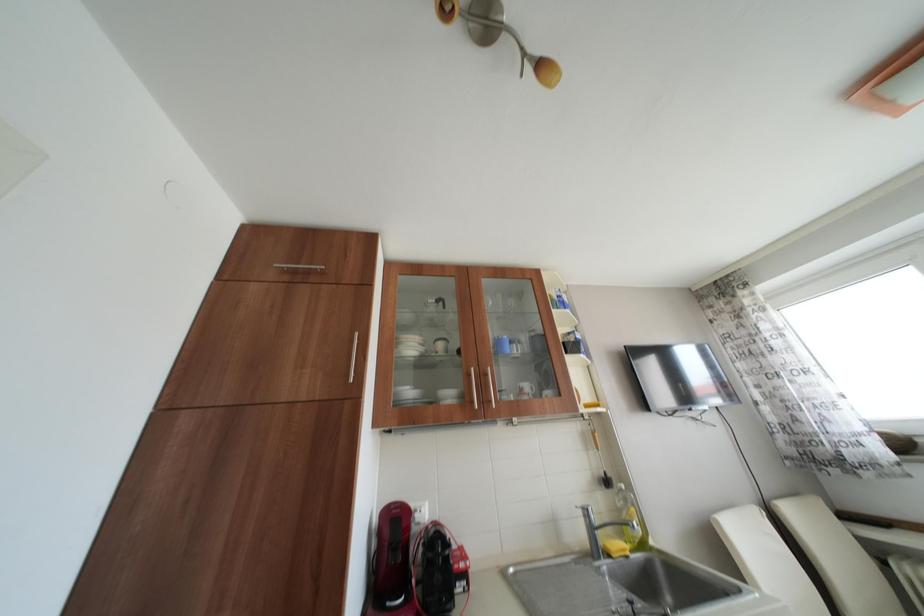
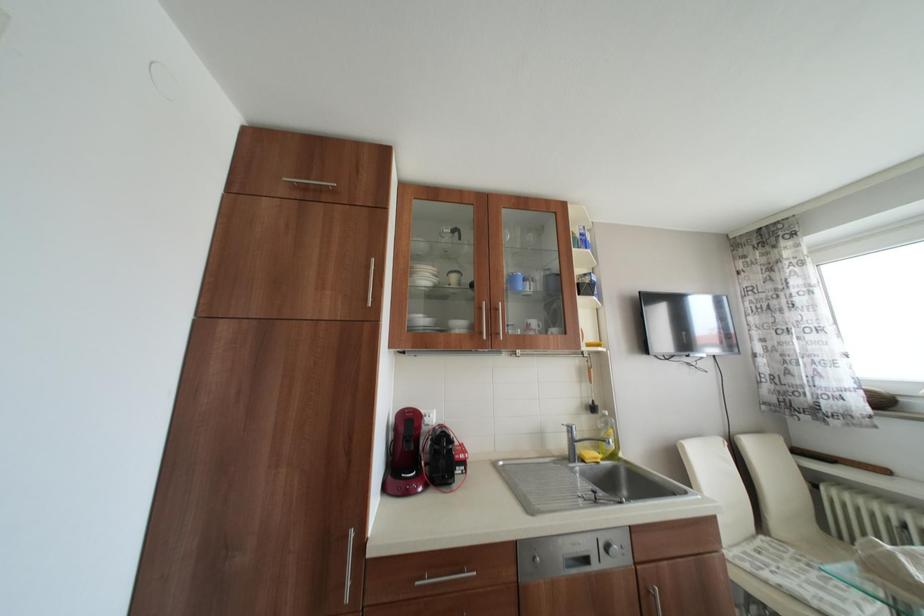
Question: The images are taken continuously from a first-person perspective. In which direction are you moving?

Choices:
 (A) Left
 (B) Right
 (C) Forward
 (D) Backward

Answer: (A)